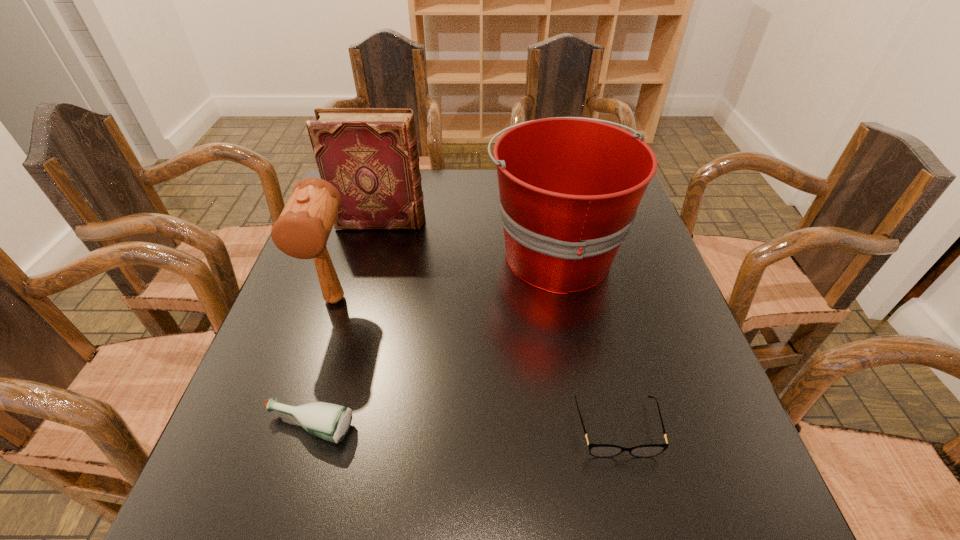
This screenshot has height=540, width=960. I want to click on hardback book, so click(x=369, y=155).

You are a GUI agent. You are given a task and a screenshot of the screen. Output one action in this format:
    pyautogui.click(x=<x>, y=<y>)
    Task: Click on the bucket
    The height and width of the screenshot is (540, 960).
    Given the screenshot: What is the action you would take?
    pyautogui.click(x=569, y=187)

I want to click on mallet, so click(x=302, y=230).

Where is `the second shortest object`? the second shortest object is located at coordinates (331, 422).

The width and height of the screenshot is (960, 540). Identify the location of the shortest object. (597, 450).

At what (x,y) coordinates should I click in order to perform the action: click on free region located on the spine side of the hardback book. Please return your answer as a coordinate pair (x, y). Image resolution: width=960 pixels, height=540 pixels. Looking at the image, I should click on (516, 221).

Identify the location of free location located on the back of the bucket. Image resolution: width=960 pixels, height=540 pixels. (543, 190).

Find the location of a particular element. Image resolution: width=960 pixels, height=540 pixels. free region located on the strike surface of the mallet is located at coordinates (289, 442).

Image resolution: width=960 pixels, height=540 pixels. I want to click on vacant space located 0.130m on the right of the fourth tallest object, so click(423, 427).

Locate an element on the screen. The width and height of the screenshot is (960, 540). free space located 0.100m on the front-facing side of the spectacles is located at coordinates (638, 520).